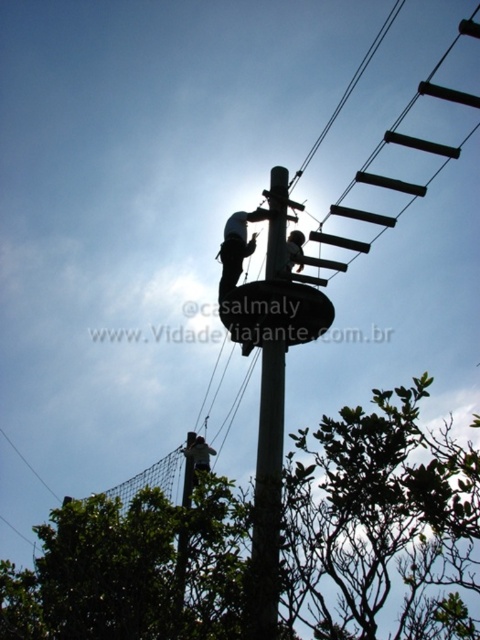
You are a participant in the high ropes course and notice the green leafy tree at lower left and the green fabric harness at center. From your perspective on the ground, which object is positioned lower?

The green leafy tree at lower left is located below the green fabric harness at center, so the green leafy tree at lower left is positioned lower.

You are standing at the center of the high ropes course and want to locate the green leafy tree at lower left. According to the coordinates provided, in which direction should you look to see it?

The green leafy tree at lower left is located at coordinates point (x=381, y=524), which corresponds to the lower left direction from your current position at the center of the high ropes course.